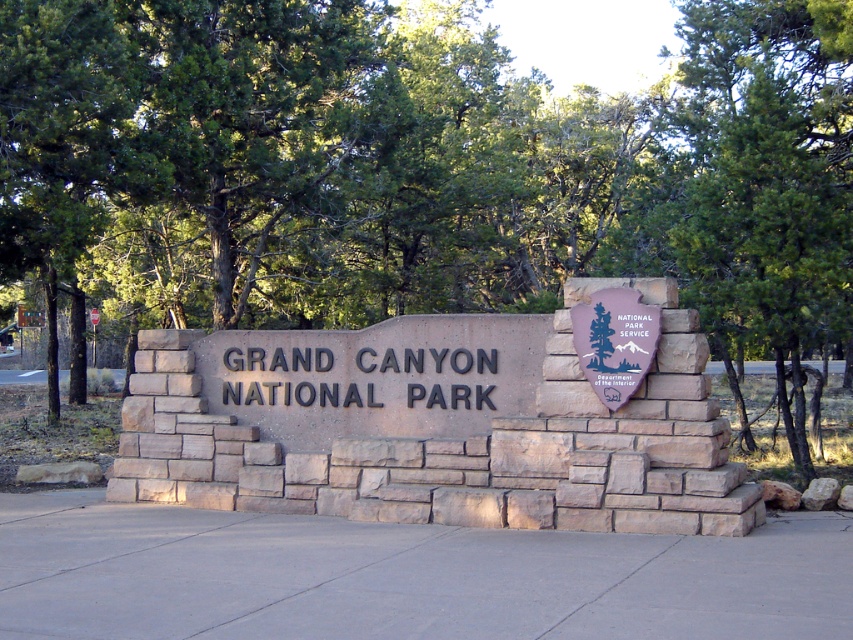
Question: Is gray concrete pavement at center to the left of purple stone shield at center from the viewer's perspective?

Choices:
 (A) no
 (B) yes

Answer: (B)

Question: Does gray concrete pavement at center appear on the left side of purple stone shield at center?

Choices:
 (A) yes
 (B) no

Answer: (A)

Question: Which point is closer to the camera taking this photo?

Choices:
 (A) (476, 589)
 (B) (631, 314)

Answer: (A)

Question: Which of the following is the farthest from the observer?

Choices:
 (A) purple stone shield at center
 (B) gray concrete pavement at center

Answer: (A)

Question: Can you confirm if gray concrete pavement at center is wider than purple stone shield at center?

Choices:
 (A) yes
 (B) no

Answer: (A)

Question: Which point is closer to the camera?

Choices:
 (A) gray concrete pavement at center
 (B) purple stone shield at center

Answer: (A)